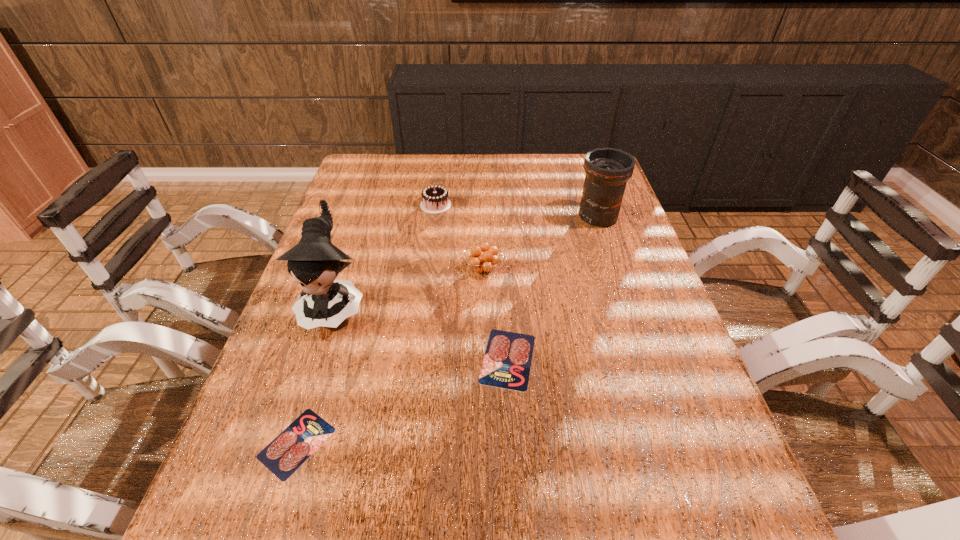
This screenshot has width=960, height=540. Find the location of `blank region between the third object from left to right and the nearest object`. blank region between the third object from left to right and the nearest object is located at coordinates 367,324.

I want to click on vacant area between the telephoto lens and the fourth object from right to left, so click(x=516, y=211).

Locate an element on the screen. vacant space in between the telephoto lens and the fifth tallest object is located at coordinates (553, 288).

The height and width of the screenshot is (540, 960). I want to click on free space between the telephoto lens and the farther salami, so click(553, 288).

I want to click on vacant space that's between the rightmost object and the orange fruit, so click(x=540, y=244).

This screenshot has height=540, width=960. I want to click on vacant area between the telephoto lens and the fourth object from right to left, so (516, 211).

Locate an element on the screen. This screenshot has height=540, width=960. the fourth closest object to the nearest object is located at coordinates (435, 199).

The image size is (960, 540). I want to click on object that is the closest to the doll, so click(x=292, y=447).

The height and width of the screenshot is (540, 960). Find the location of `vacant space that satisfies the following two spatial constraints: 1. on the front side of the right salami; 2. on the left side of the orange fruit`. vacant space that satisfies the following two spatial constraints: 1. on the front side of the right salami; 2. on the left side of the orange fruit is located at coordinates (484, 359).